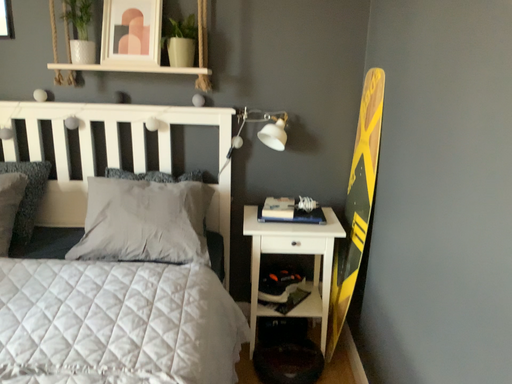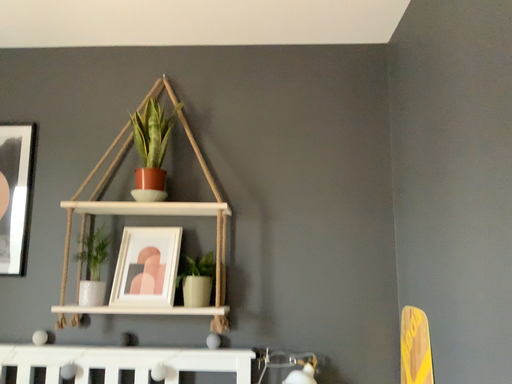
Question: How did the camera likely rotate when shooting the video?

Choices:
 (A) rotated downward
 (B) rotated upward

Answer: (B)